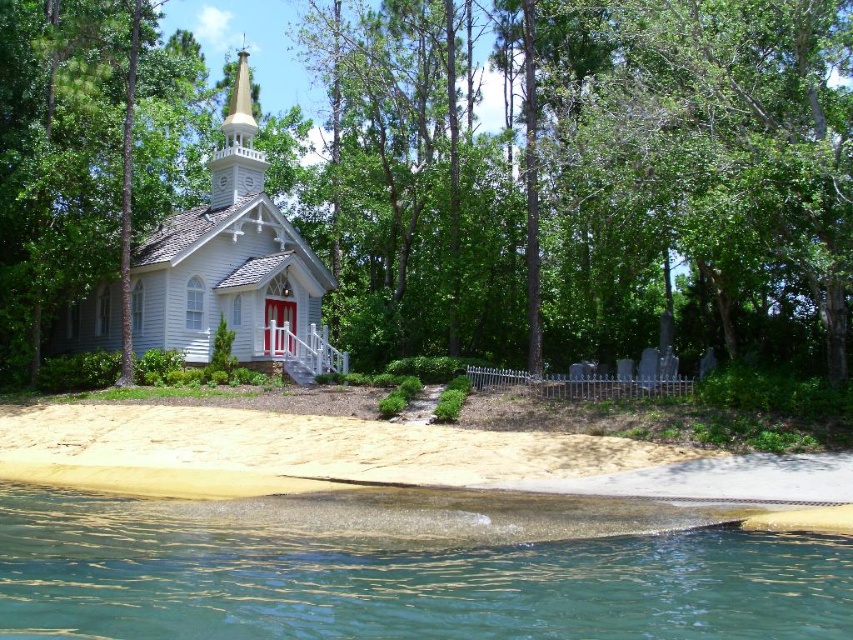
You are standing in front of the white chapel on the shoreline and notice two points marked in the scene. The first point is at coordinates point (10, 6) and the second is at point (27, 451). Which of these two points is closer to you as you face the chapel?

Point (10, 6) is closer to you because it is further to the viewer than point (27, 451).

You are a photographer planning to capture the white wooden church at center and the clear glass water at lower left in a single frame. Based on their sizes in the image, which object will appear more prominent in the photo?

The white wooden church at center will appear more prominent in the photo because it is larger than the clear glass water at lower left.

You are standing at the entrance of the chapel and want to take a photo of the green leafy tree at center. Which direction should you face to capture it in your view?

The green leafy tree at center is located at point (582, 176), which is to the left of the chapel. Therefore, you should face to the left side of the chapel to capture the green leafy tree at center in your view.